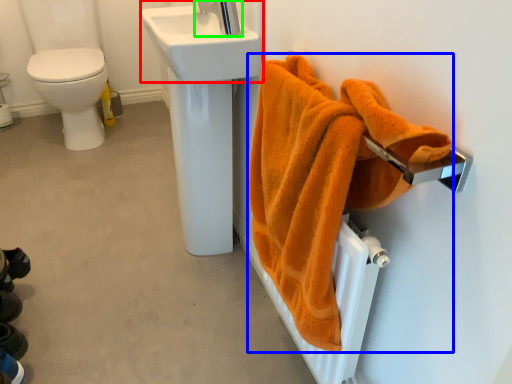
Question: Estimate the real-world distances between objects in this image. Which object is closer to sink (highlighted by a red box), towel (highlighted by a blue box) or tap (highlighted by a green box)?

Choices:
 (A) towel
 (B) tap

Answer: (B)